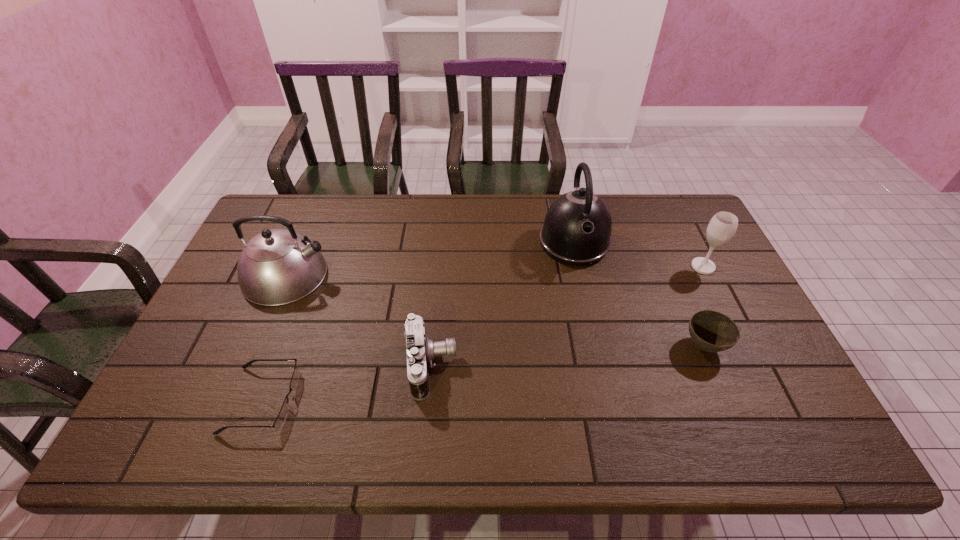
Find the location of a particular element. wineglass that is at the right edge is located at coordinates (723, 225).

Where is `bowl present at the right edge`? The height and width of the screenshot is (540, 960). bowl present at the right edge is located at coordinates (711, 331).

Where is `object located in the near left corner section of the desktop`? The image size is (960, 540). object located in the near left corner section of the desktop is located at coordinates (282, 416).

This screenshot has height=540, width=960. Find the location of `vacant space at the far edge`. vacant space at the far edge is located at coordinates (352, 208).

Find the location of `blank space at the left edge of the desktop`. blank space at the left edge of the desktop is located at coordinates (217, 337).

Locate an element on the screen. This screenshot has width=960, height=540. blank space at the right edge of the desktop is located at coordinates (714, 303).

The width and height of the screenshot is (960, 540). In the image, there is a desktop. Find the location of `blank space at the far left corner`. blank space at the far left corner is located at coordinates (291, 214).

Find the location of `empty space that is in between the wineglass and the spectacles`. empty space that is in between the wineglass and the spectacles is located at coordinates (483, 333).

The height and width of the screenshot is (540, 960). I want to click on empty space between the camera and the fourth shortest object, so click(567, 316).

Locate an element on the screen. The height and width of the screenshot is (540, 960). free space between the camera and the second shortest object is located at coordinates (567, 356).